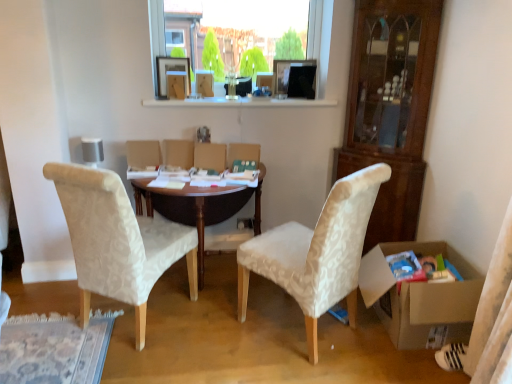
Question: Does brown wooden table at center turn towards cardboard box at lower right?

Choices:
 (A) yes
 (B) no

Answer: (B)

Question: Is brown wooden table at center thinner than cardboard box at lower right?

Choices:
 (A) no
 (B) yes

Answer: (A)

Question: From a real-world perspective, is brown wooden table at center beneath cardboard box at lower right?

Choices:
 (A) yes
 (B) no

Answer: (B)

Question: Can you confirm if brown wooden table at center is smaller than cardboard box at lower right?

Choices:
 (A) yes
 (B) no

Answer: (B)

Question: From the image's perspective, would you say brown wooden table at center is shown under cardboard box at lower right?

Choices:
 (A) no
 (B) yes

Answer: (A)

Question: Is brown wooden table at center at the right side of cardboard box at lower right?

Choices:
 (A) no
 (B) yes

Answer: (A)

Question: Does brown wooden table at center lie in front of beige fabric chair at left, which is the first chair from left to right?

Choices:
 (A) yes
 (B) no

Answer: (B)

Question: From a real-world perspective, is brown wooden table at center positioned under beige fabric chair at left, which is the first chair from left to right, based on gravity?

Choices:
 (A) yes
 (B) no

Answer: (A)

Question: Would you say brown wooden table at center contains beige fabric chair at left, which is the 2th chair from right to left?

Choices:
 (A) yes
 (B) no

Answer: (B)

Question: From the image's perspective, is brown wooden table at center over beige fabric chair at left, which is the first chair from left to right?

Choices:
 (A) no
 (B) yes

Answer: (B)

Question: Is brown wooden table at center positioned behind beige fabric chair at left, which is the 2th chair from right to left?

Choices:
 (A) yes
 (B) no

Answer: (A)

Question: Is brown wooden table at center shorter than beige fabric chair at left, which is the first chair from left to right?

Choices:
 (A) yes
 (B) no

Answer: (A)

Question: Can you confirm if brown wooden table at center is bigger than transparent glass window at upper center?

Choices:
 (A) yes
 (B) no

Answer: (A)